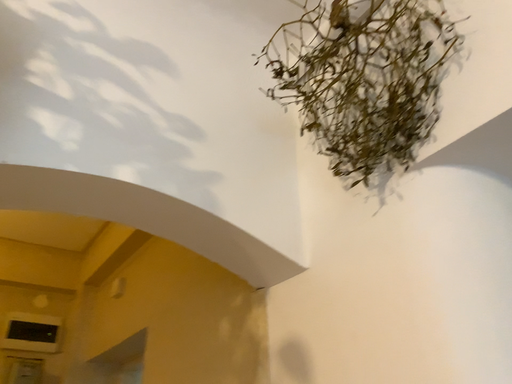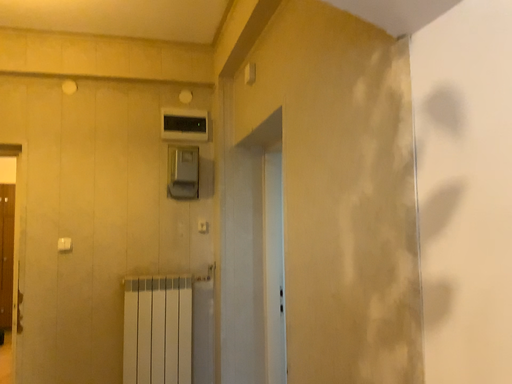
Question: How did the camera likely rotate when shooting the video?

Choices:
 (A) rotated right
 (B) rotated left

Answer: (B)